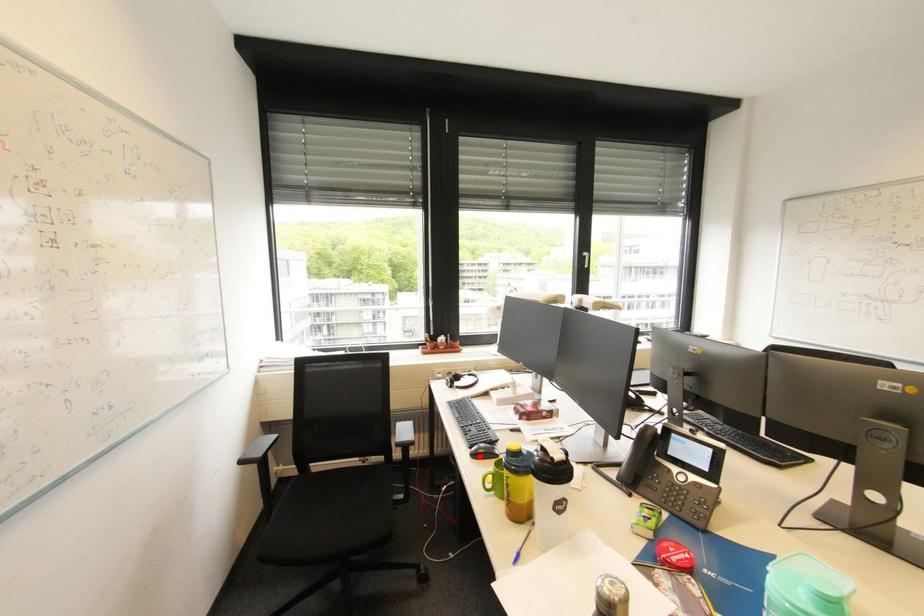
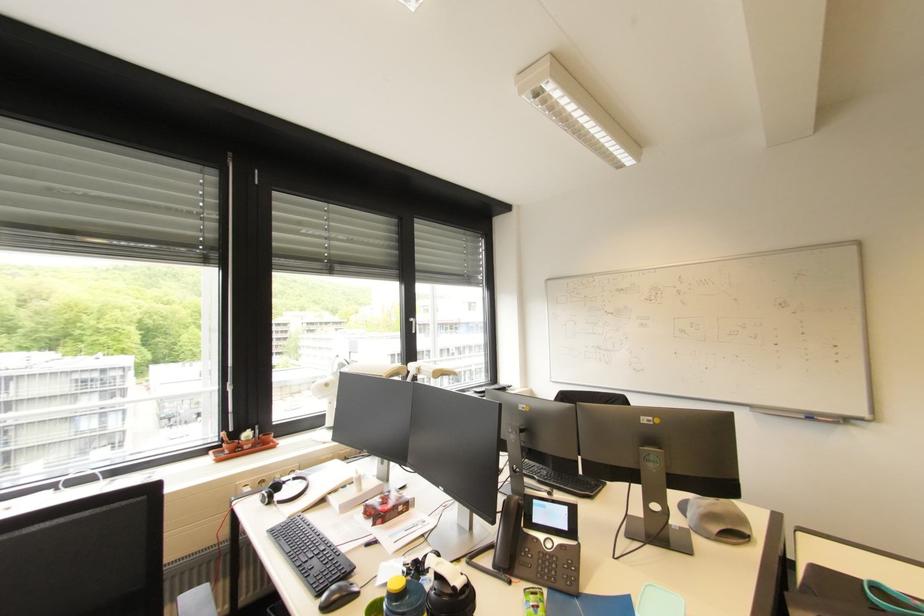
Question: I am providing you with two images of the same scene from different viewpoints. A red point is marked on the first image. Can you still see the location of the red point in image 2?

Choices:
 (A) Yes
 (B) No

Answer: (A)